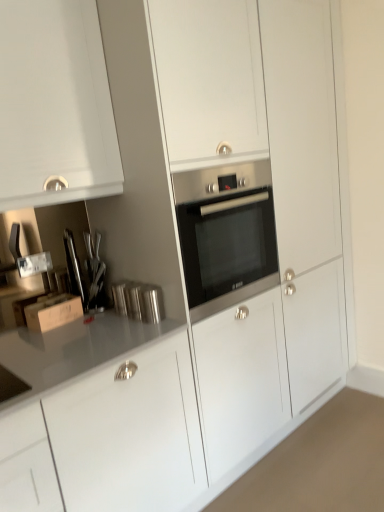
Question: In terms of size, does stainless steel oven at center appear bigger or smaller than cardboard box at left?

Choices:
 (A) small
 (B) big

Answer: (B)

Question: Considering the positions of point (258, 262) and point (56, 320), is point (258, 262) closer or farther from the camera than point (56, 320)?

Choices:
 (A) closer
 (B) farther

Answer: (B)

Question: Relative to cardboard box at left, is stainless steel oven at center in front or behind?

Choices:
 (A) behind
 (B) front

Answer: (B)

Question: Looking at their shapes, would you say cardboard box at left is wider or thinner than stainless steel oven at center?

Choices:
 (A) wide
 (B) thin

Answer: (B)

Question: From a real-world perspective, relative to stainless steel oven at center, is cardboard box at left vertically above or below?

Choices:
 (A) below
 (B) above

Answer: (A)

Question: Which is correct: cardboard box at left is inside stainless steel oven at center, or outside of it?

Choices:
 (A) inside
 (B) outside

Answer: (B)

Question: Is cardboard box at left bigger or smaller than stainless steel oven at center?

Choices:
 (A) small
 (B) big

Answer: (A)